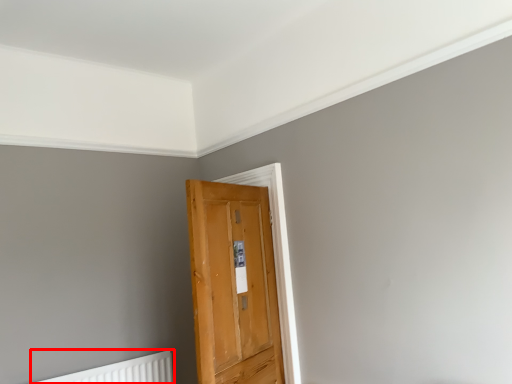
Question: From the image's perspective, considering the relative positions of radiator (annotated by the red box) and door in the image provided, where is radiator (annotated by the red box) located with respect to the staircase?

Choices:
 (A) below
 (B) above

Answer: (A)